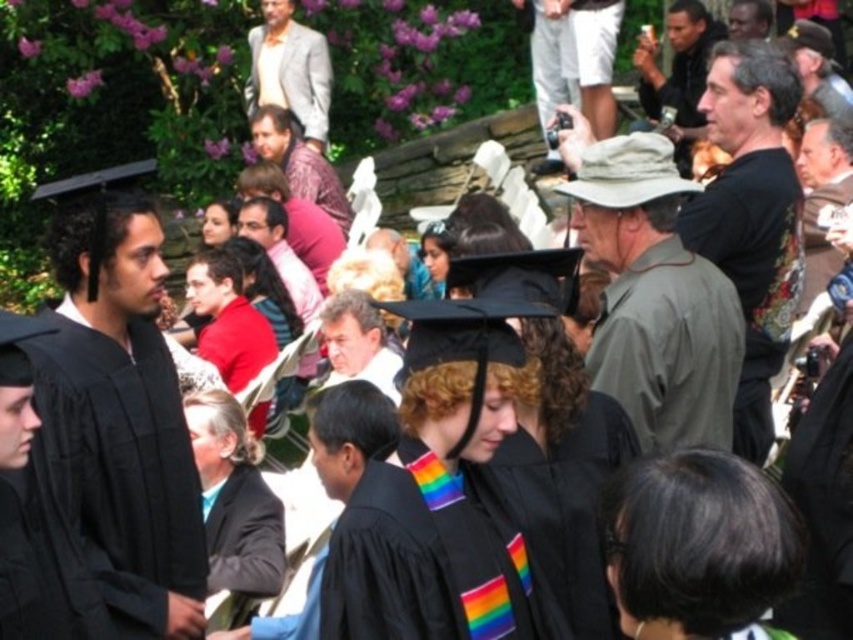
You are standing at the ceremony and want to hand a congratulatory card to the person wearing the light gray suit at upper center. Considering the distance, can you accurately throw the card to them without moving closer?

The light gray suit at upper center is 37.21 meters away from viewer. Throwing a card that far would be extremely difficult and likely inaccurate, so it is not advisable to attempt this without moving closer.